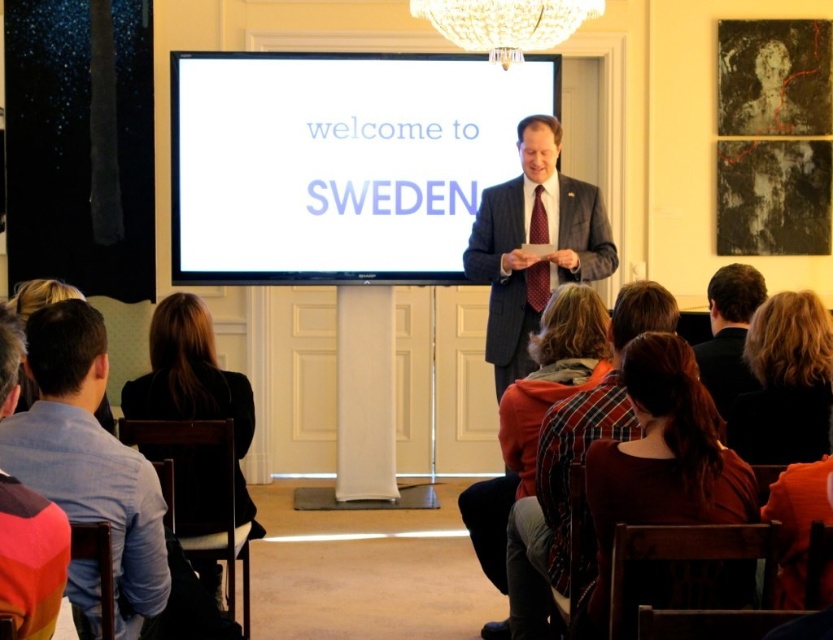
Between point (662, 422) and point (536, 218), which one is positioned in front?

Point (662, 422) is more forward.

Does dark brown leather chair at lower right come behind red textured tie at center?

No.

Who is more forward, (716, 497) or (535, 234)?

Point (716, 497) is in front.

Locate an element on the screen. This screenshot has width=833, height=640. dark brown leather chair at lower right is located at coordinates (661, 465).

Is point (352, 168) positioned behind point (103, 403)?

Yes, point (352, 168) is farther from viewer.

Is white glossy projection screen at center positioned at the back of light brown hair at lower left?

Yes, white glossy projection screen at center is further from the viewer.

Is point (252, 234) farther from camera compared to point (52, 291)?

Yes, point (252, 234) is farther from viewer.

In order to click on white glossy projection screen at center in this screenshot , I will do `click(338, 163)`.

Between white glossy projection screen at center and multicolored fabric at lower left, which one appears on the left side from the viewer's perspective?

multicolored fabric at lower left is more to the left.

You are a GUI agent. You are given a task and a screenshot of the screen. Output one action in this format:
    pyautogui.click(x=<x>, y=<y>)
    Task: Click on the white glossy projection screen at center
    
    Given the screenshot: What is the action you would take?
    pyautogui.click(x=338, y=163)

You are a GUI agent. You are given a task and a screenshot of the screen. Output one action in this format:
    pyautogui.click(x=<x>, y=<y>)
    Task: Click on the white glossy projection screen at center
    
    Given the screenshot: What is the action you would take?
    (338, 163)